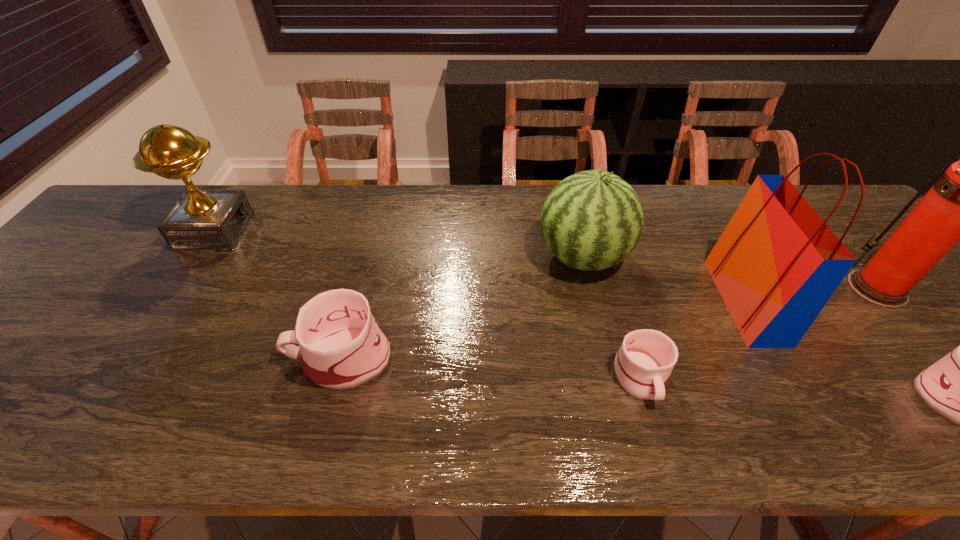
You are a GUI agent. You are given a task and a screenshot of the screen. Output one action in this format:
    pyautogui.click(x=<x>, y=<y>)
    Task: Click on the fifth tallest object
    This screenshot has width=960, height=540.
    Given the screenshot: What is the action you would take?
    pyautogui.click(x=341, y=347)

The image size is (960, 540). What are the coordinates of `the tallest mug` in the screenshot? It's located at (x=341, y=347).

The image size is (960, 540). I want to click on the shortest mug, so click(x=642, y=366).

At what (x,y) coordinates should I click in order to perform the action: click on the shortest object. Please return your answer as a coordinate pair (x, y). Looking at the image, I should click on (642, 366).

I want to click on shopping bag, so click(777, 263).

Find the location of a particular element. watermelon is located at coordinates (592, 220).

The width and height of the screenshot is (960, 540). Identify the location of award. (201, 219).

Where is `fire extinguisher`? The image size is (960, 540). fire extinguisher is located at coordinates (959, 206).

Where is `free space located on the side with the handle of the third shortest object`? The height and width of the screenshot is (540, 960). free space located on the side with the handle of the third shortest object is located at coordinates (252, 357).

Where is `free spot located on the side with the handle of the third shortest object`? free spot located on the side with the handle of the third shortest object is located at coordinates (244, 357).